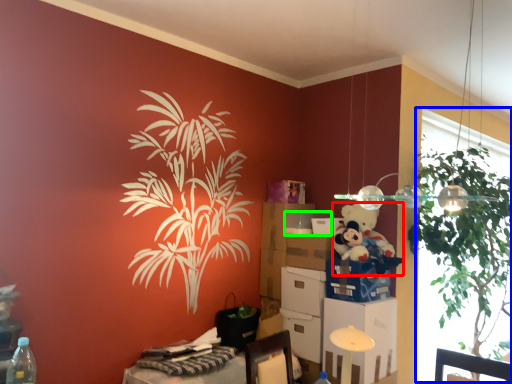
Question: Based on their relative distances, which object is nearer to teddy bear (highlighted by a red box)? Choose from window screen (highlighted by a blue box) and box (highlighted by a green box).

Choices:
 (A) window screen
 (B) box

Answer: (B)